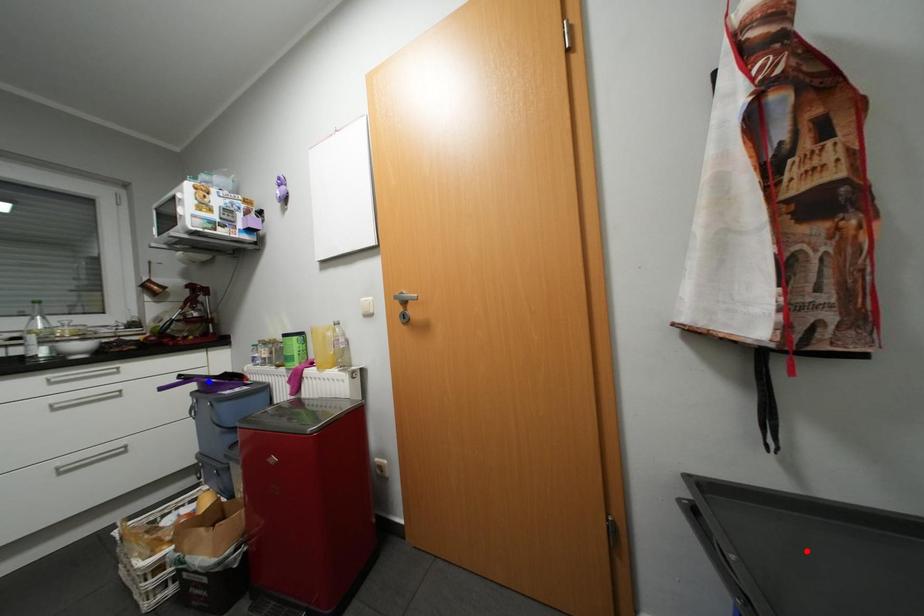
Question: Two points are marked on the image. Which point is closer to the camera?

Choices:
 (A) Blue point is closer.
 (B) Red point is closer.

Answer: (B)